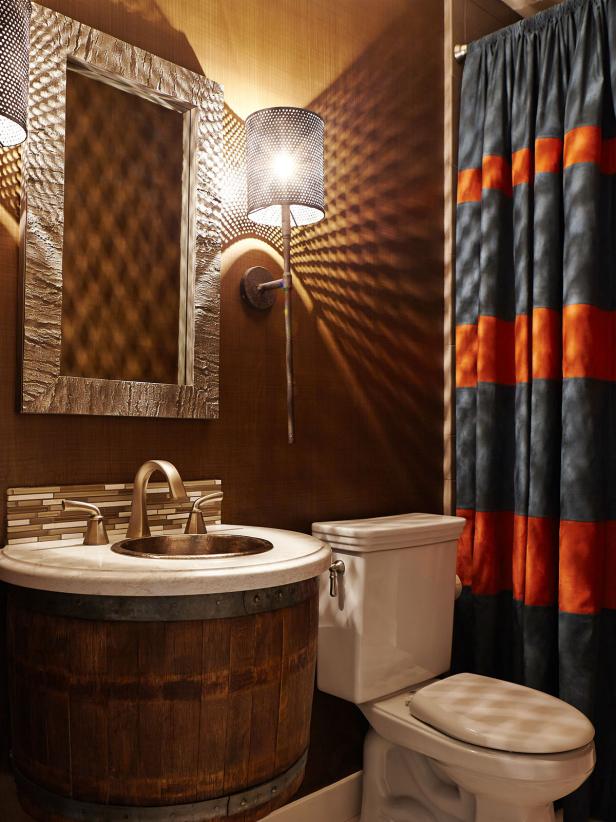
This screenshot has width=616, height=822. What are the coordinates of `toilet tank lid` in the screenshot? It's located at (392, 529).